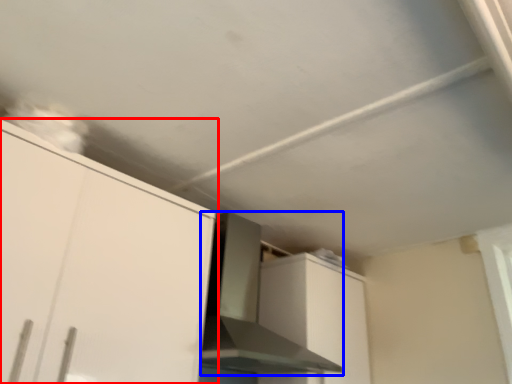
Question: Which object is closer to the camera taking this photo, cabinetry (highlighted by a red box) or vent (highlighted by a blue box)?

Choices:
 (A) cabinetry
 (B) vent

Answer: (A)